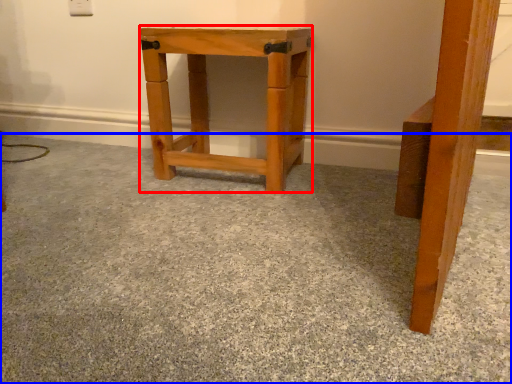
Question: Which point is closer to the camera, stool (highlighted by a red box) or concrete (highlighted by a blue box)?

Choices:
 (A) stool
 (B) concrete

Answer: (B)